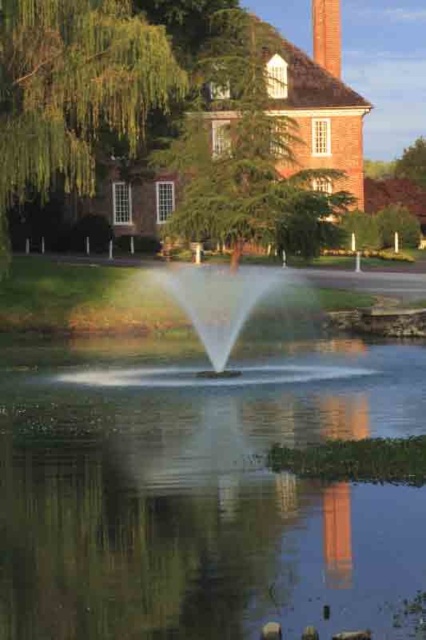
Can you confirm if clear water at center is positioned to the left of green leafy tree at upper center?

Correct, you'll find clear water at center to the left of green leafy tree at upper center.

Between clear water at center and green leafy tree at upper center, which one appears on the right side from the viewer's perspective?

green leafy tree at upper center

You are a GUI agent. You are given a task and a screenshot of the screen. Output one action in this format:
    pyautogui.click(x=<x>, y=<y>)
    Task: Click on the clear water at center
    
    Given the screenshot: What is the action you would take?
    pyautogui.click(x=203, y=499)

Identify the location of clear water at center. (203, 499).

Does green leafy tree at upper center appear under red brick chimney at upper center?

Yes.

Between green leafy tree at upper center and red brick chimney at upper center, which one has more height?

Standing taller between the two is red brick chimney at upper center.

Find the location of a particular element. green leafy tree at upper center is located at coordinates (264, 145).

Between point (221, 579) and point (325, 28), which one is positioned behind?

Positioned behind is point (325, 28).

Based on the photo, is clear water at center to the right of red brick chimney at upper center from the viewer's perspective?

In fact, clear water at center is to the left of red brick chimney at upper center.

Locate an element on the screen. The height and width of the screenshot is (640, 426). clear water at center is located at coordinates (203, 499).

At what (x,y) coordinates should I click in order to perform the action: click on clear water at center. Please return your answer as a coordinate pair (x, y). Image resolution: width=426 pixels, height=640 pixels. Looking at the image, I should click on (203, 499).